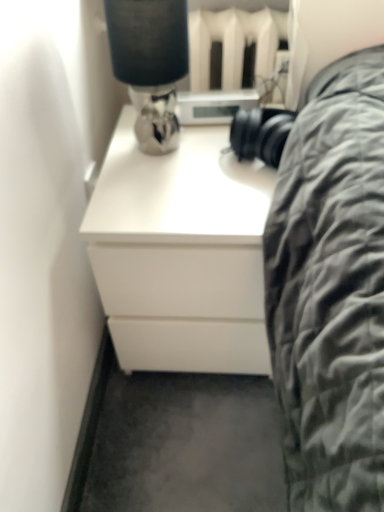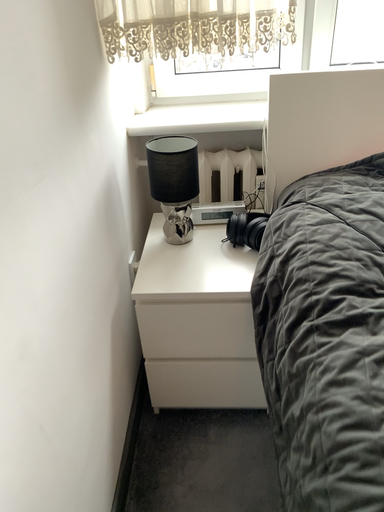
Question: Which way did the camera rotate in the video?

Choices:
 (A) rotated downward
 (B) rotated upward

Answer: (B)